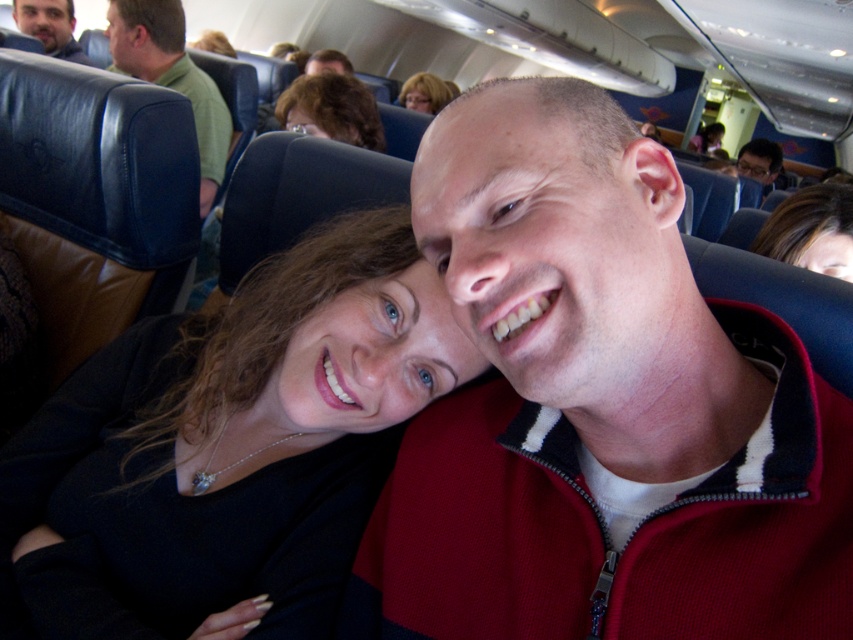
Between red zippered jacket at center and blonde hair at upper center, which one appears on the left side from the viewer's perspective?

From the viewer's perspective, blonde hair at upper center appears more on the left side.

Describe the element at coordinates (599, 408) in the screenshot. I see `red zippered jacket at center` at that location.

The height and width of the screenshot is (640, 853). In order to click on red zippered jacket at center in this screenshot , I will do `click(599, 408)`.

Which is below, blonde hair at upper center or matte black glasses at upper right?

blonde hair at upper center is lower down.

Can you confirm if blonde hair at upper center is bigger than matte black glasses at upper right?

No, blonde hair at upper center is not bigger than matte black glasses at upper right.

Find the location of a particular element. blonde hair at upper center is located at coordinates (331, 109).

Image resolution: width=853 pixels, height=640 pixels. What are the coordinates of `blonde hair at upper center` in the screenshot? It's located at (331, 109).

What do you see at coordinates (171, 76) in the screenshot? I see `green matte chair at upper left` at bounding box center [171, 76].

Which is behind, point (119, 68) or point (67, 6)?

The point (67, 6) is behind.

Find the location of a particular element. green matte chair at upper left is located at coordinates (171, 76).